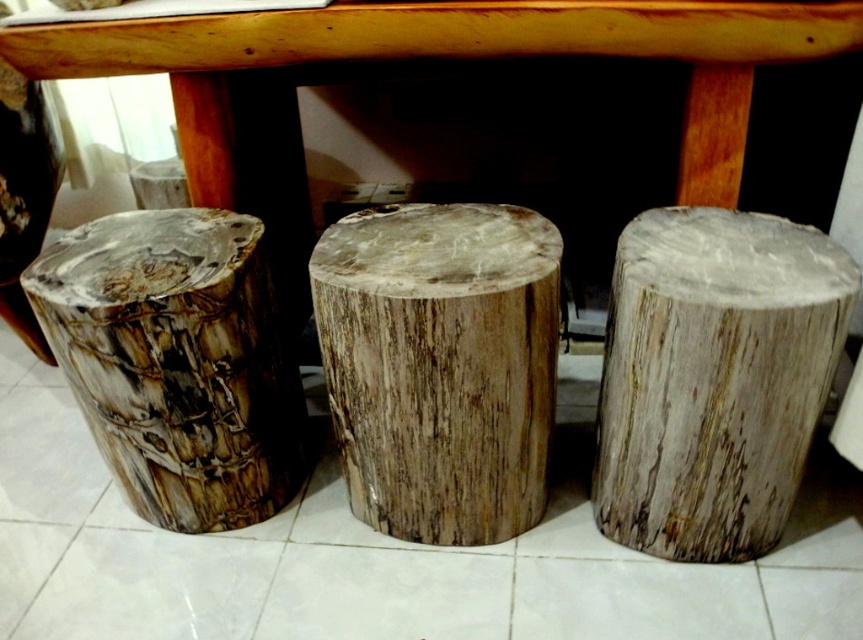
Consider the image. Can you confirm if natural wood stump at center is smaller than wooden table at center?

Indeed, natural wood stump at center has a smaller size compared to wooden table at center.

Who is lower down, natural wood stump at center or wooden table at center?

natural wood stump at center is lower down.

The image size is (863, 640). In order to click on natural wood stump at center in this screenshot , I will do pos(439,365).

How much distance is there between natural wood stump at right and natural wood stump at center?

9.87 inches

Between point (803, 298) and point (520, 502), which one is positioned in front?

Point (803, 298)

The height and width of the screenshot is (640, 863). In order to click on natural wood stump at right in this screenshot , I will do `click(715, 378)`.

Which is in front, point (756, 310) or point (225, 435)?

Point (756, 310) is in front.

Is natural wood stump at right shorter than fossilized wood stump at left?

No.

Which is behind, point (637, 244) or point (244, 300)?

Positioned behind is point (244, 300).

The image size is (863, 640). What are the coordinates of `natural wood stump at right` in the screenshot? It's located at (715, 378).